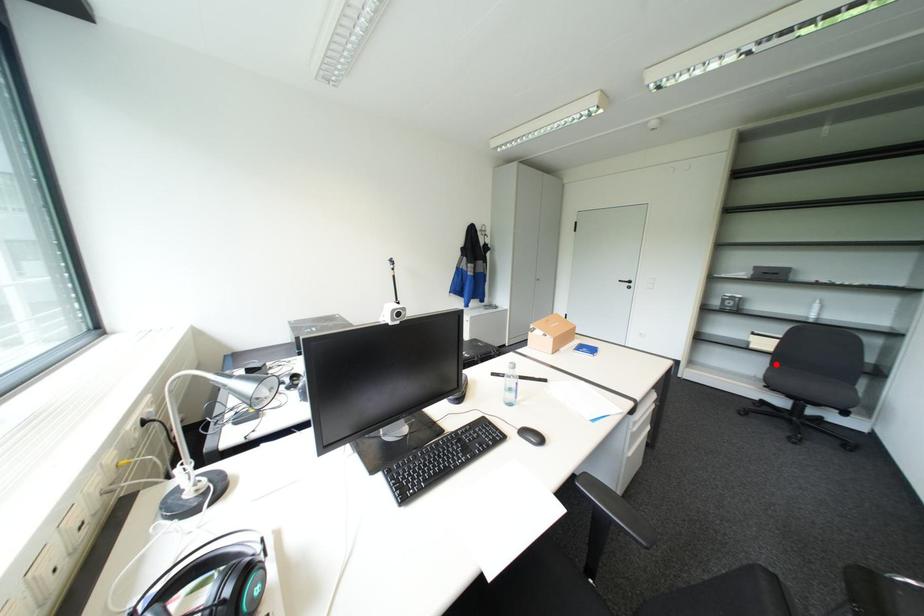
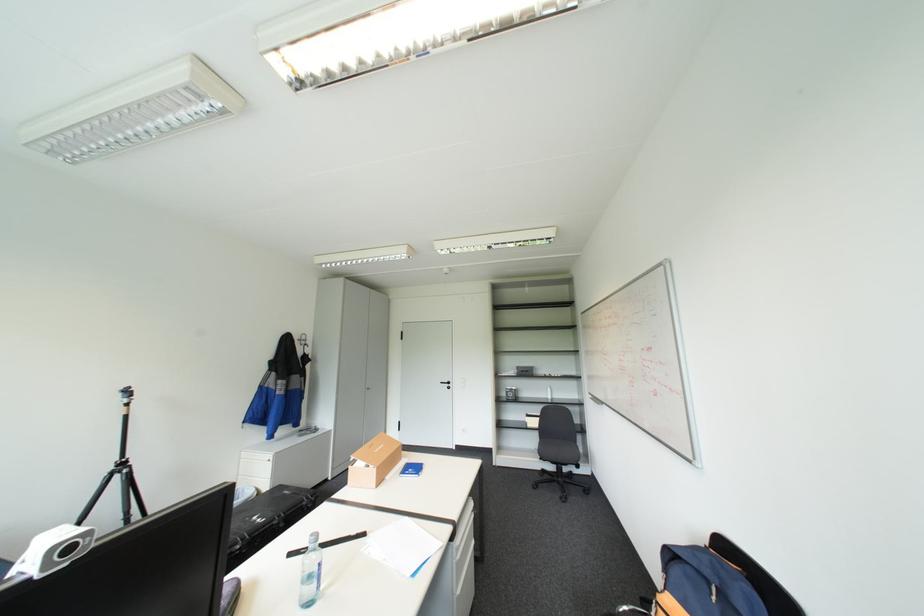
Question: I am providing you with two images of the same scene from different viewpoints. In image1, a red point is highlighted. Considering the same 3D point in image2, which of the following is correct?

Choices:
 (A) It is closer
 (B) It is farther

Answer: (B)